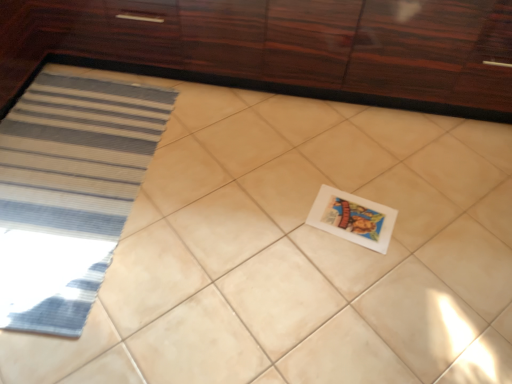
Question: In the image, is glossy wood cabinetry at upper center positioned in front of or behind white matte postcard at center?

Choices:
 (A) front
 (B) behind

Answer: (A)

Question: Considering the positions of point (506, 13) and point (357, 223), is point (506, 13) closer or farther from the camera than point (357, 223)?

Choices:
 (A) closer
 (B) farther

Answer: (A)

Question: From a real-world perspective, is glossy wood cabinetry at upper center physically located above or below white matte postcard at center?

Choices:
 (A) below
 (B) above

Answer: (B)

Question: From a real-world perspective, is white matte postcard at center positioned above or below glossy wood cabinetry at upper center?

Choices:
 (A) above
 (B) below

Answer: (B)

Question: Is white matte postcard at center inside the boundaries of glossy wood cabinetry at upper center, or outside?

Choices:
 (A) inside
 (B) outside

Answer: (B)

Question: Does point (356, 226) appear closer or farther from the camera than point (102, 21)?

Choices:
 (A) farther
 (B) closer

Answer: (B)

Question: Considering their positions, is white matte postcard at center located in front of or behind glossy wood cabinetry at upper center?

Choices:
 (A) behind
 (B) front

Answer: (A)